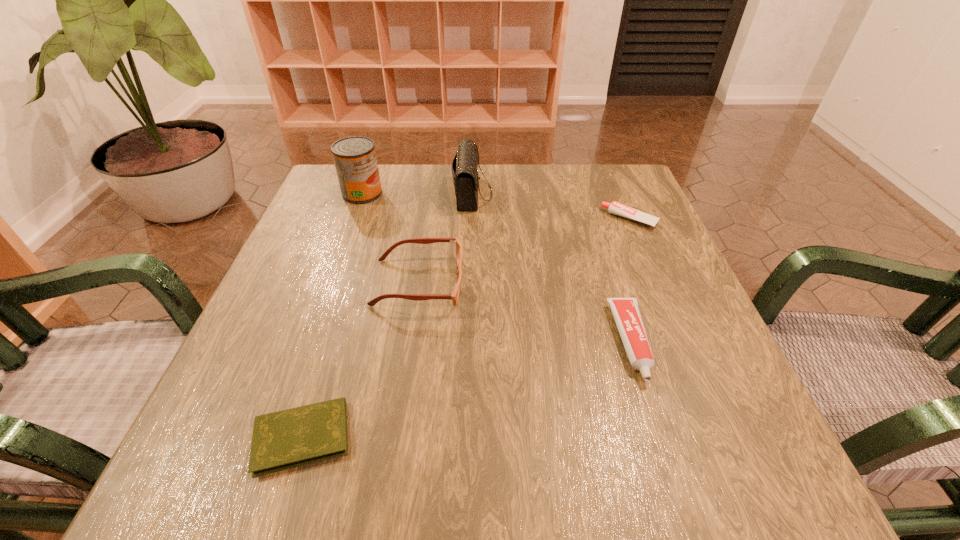
Where is `free space that is in between the spectacles and the clutch bag`? free space that is in between the spectacles and the clutch bag is located at coordinates (445, 238).

Where is `free space between the third shortest object and the second tallest object`? The height and width of the screenshot is (540, 960). free space between the third shortest object and the second tallest object is located at coordinates (552, 267).

Locate an element on the screen. This screenshot has height=540, width=960. object that is the closest to the shortest object is located at coordinates (454, 296).

Choose which object is the third nearest neighbor to the spectacles. Please provide its 2D coordinates. Your answer should be formatted as a tuple, i.e. [(x, y)], where the tuple contains the x and y coordinates of a point satisfying the conditions above.

[(355, 160)]

Find the location of a particular element. This screenshot has height=540, width=960. free space that satisfies the following two spatial constraints: 1. on the front side of the can; 2. on the left side of the shorter toothpaste is located at coordinates (353, 219).

Where is `vacant space that satisfies the following two spatial constraints: 1. on the front side of the shortest object; 2. on the left side of the can`? This screenshot has width=960, height=540. vacant space that satisfies the following two spatial constraints: 1. on the front side of the shortest object; 2. on the left side of the can is located at coordinates (276, 437).

Where is `free space that satisfies the following two spatial constraints: 1. on the back side of the shorter toothpaste; 2. on the front flap of the fifth shortest object`? free space that satisfies the following two spatial constraints: 1. on the back side of the shorter toothpaste; 2. on the front flap of the fifth shortest object is located at coordinates (619, 193).